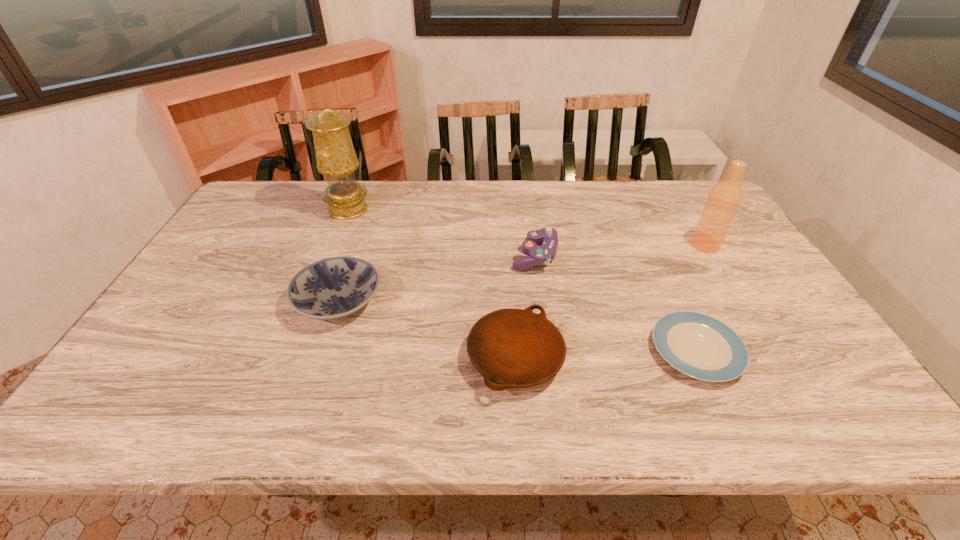
I want to click on vacant area located 0.310m on the front of the second tallest object, so pos(759,333).

Find the location of a particular element. vacant region located 0.210m on the front of the control is located at coordinates (546, 332).

The width and height of the screenshot is (960, 540). I want to click on vacant region located on the back of the leftmost plate, so click(x=353, y=256).

Where is `free space located 0.270m on the back of the second plate from left to right`? This screenshot has width=960, height=540. free space located 0.270m on the back of the second plate from left to right is located at coordinates (508, 253).

Identify the location of vacant area located on the left of the rightmost plate. The width and height of the screenshot is (960, 540). (588, 351).

Where is `object that is at the far edge`? object that is at the far edge is located at coordinates (336, 159).

Locate an element on the screen. This screenshot has height=540, width=960. object at the near edge is located at coordinates (511, 348).

At what (x,y) coordinates should I click in order to perform the action: click on object located in the right edge section of the desktop. Please return your answer as a coordinate pair (x, y). Image resolution: width=960 pixels, height=540 pixels. Looking at the image, I should click on (722, 203).

Find the location of a particular element. Image resolution: width=960 pixels, height=540 pixels. free location at the far edge is located at coordinates (632, 207).

Find the location of a particular element. Image resolution: width=960 pixels, height=540 pixels. free space at the near edge of the desktop is located at coordinates tap(480, 413).